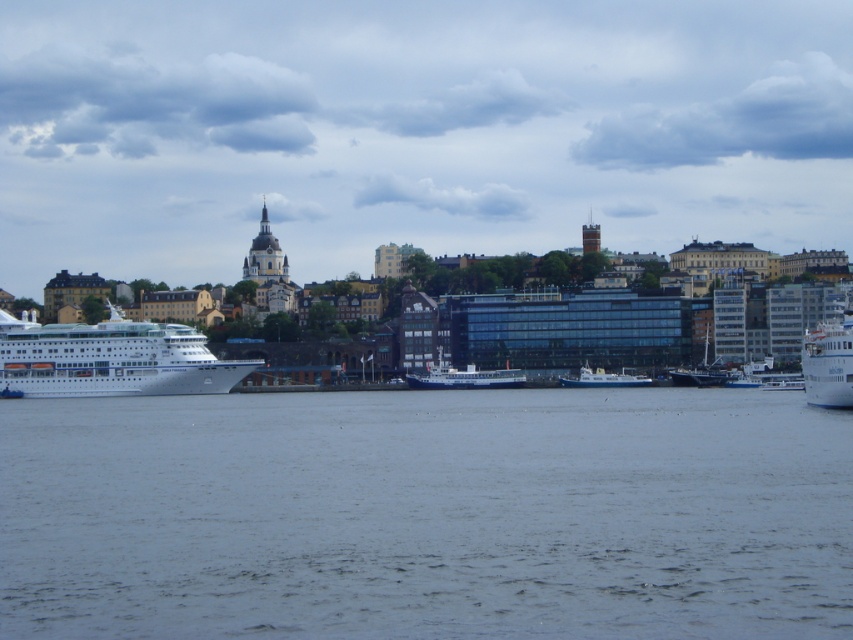
Is point (730, 372) closer to camera compared to point (610, 376)?

No.

Does blue metallic boat at center have a smaller size compared to white matte boat at center?

No.

The width and height of the screenshot is (853, 640). What are the coordinates of `blue metallic boat at center` in the screenshot? It's located at (701, 371).

Is gray water at center closer to the viewer compared to blue metallic boat at center?

Yes, it is in front of blue metallic boat at center.

Which is behind, point (648, 612) or point (704, 381)?

The point (704, 381) is behind.

At what (x,y) coordinates should I click in order to perform the action: click on gray water at center. Please return your answer as a coordinate pair (x, y). The width and height of the screenshot is (853, 640). Looking at the image, I should click on (427, 515).

At what (x,y) coordinates should I click in order to perform the action: click on gray water at center. Please return your answer as a coordinate pair (x, y). Looking at the image, I should click on (427, 515).

The height and width of the screenshot is (640, 853). What do you see at coordinates (427, 515) in the screenshot?
I see `gray water at center` at bounding box center [427, 515].

Between point (456, 500) and point (633, 374), which one is positioned behind?

The point (633, 374) is more distant.

Between point (96, 634) and point (593, 385), which one is positioned in front?

Positioned in front is point (96, 634).

Where is `gray water at center`? gray water at center is located at coordinates (427, 515).